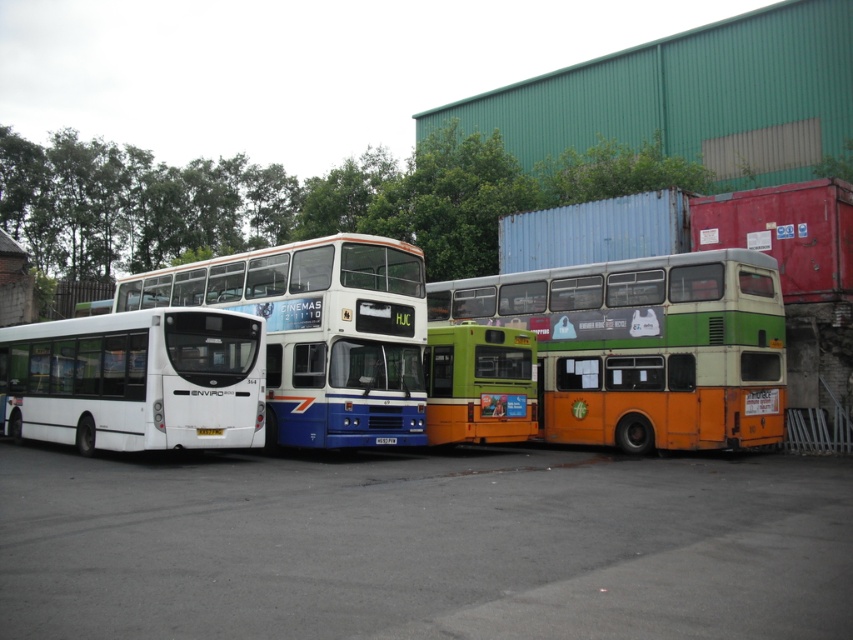
Question: Can you confirm if white matte bus at left is wider than green matte bus at center?

Choices:
 (A) no
 (B) yes

Answer: (B)

Question: Among these objects, which one is nearest to the camera?

Choices:
 (A) green matte double-decker bus at center
 (B) white glossy double-decker bus at center
 (C) gray asphalt at center

Answer: (C)

Question: Which point is closer to the camera taking this photo?

Choices:
 (A) (7, 355)
 (B) (469, 324)
 (C) (737, 381)

Answer: (C)

Question: Can you confirm if green matte double-decker bus at center is positioned above white matte bus at left?

Choices:
 (A) no
 (B) yes

Answer: (B)

Question: Among these points, which one is nearest to the camera?

Choices:
 (A) (97, 541)
 (B) (575, 353)
 (C) (534, 374)

Answer: (A)

Question: Is green matte double-decker bus at center behind white matte bus at left?

Choices:
 (A) yes
 (B) no

Answer: (A)